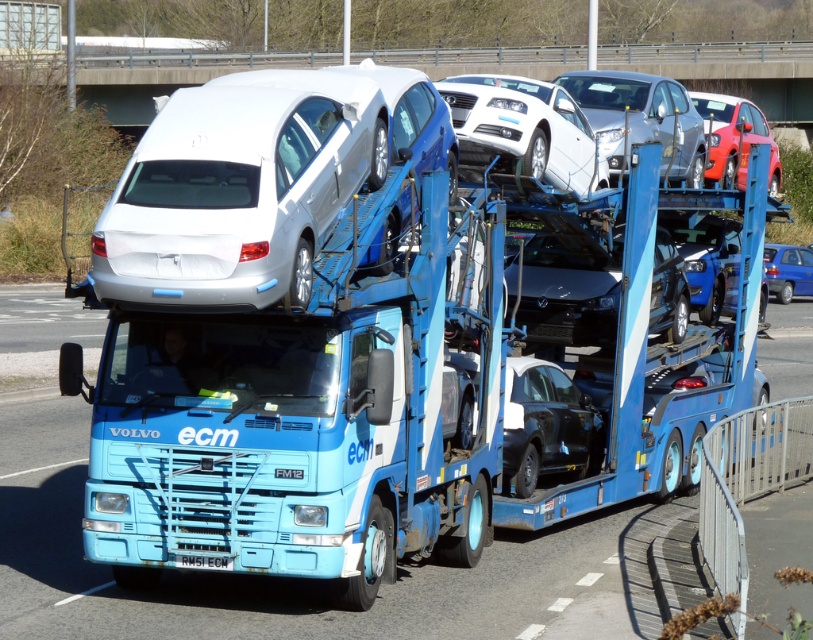
Does blue metallic truck at center have a greater width compared to white plastic license plate at center?

Yes, blue metallic truck at center is wider than white plastic license plate at center.

Is blue metallic truck at center to the right of white plastic license plate at center from the viewer's perspective?

Indeed, blue metallic truck at center is positioned on the right side of white plastic license plate at center.

Find the location of `blue metallic truck at center`. blue metallic truck at center is located at coordinates coord(380,401).

This screenshot has width=813, height=640. Find the location of `blue metallic truck at center`. blue metallic truck at center is located at coordinates (380, 401).

Between point (593, 179) and point (189, 566), which one is positioned in front?

Positioned in front is point (189, 566).

Who is shorter, white glossy sedan at upper center or white plastic license plate at center?

Standing shorter between the two is white plastic license plate at center.

Does point (518, 154) lie in front of point (198, 563)?

No.

At what (x,y) coordinates should I click in order to perform the action: click on white glossy sedan at upper center. Please return your answer as a coordinate pair (x, y). The height and width of the screenshot is (640, 813). Looking at the image, I should click on (524, 129).

Which is in front, point (801, 280) or point (229, 564)?

Positioned in front is point (229, 564).

Which of these two, blue metallic hatchback at right or white plastic license plate at center, stands taller?

blue metallic hatchback at right is taller.

Is point (809, 292) behind point (225, 557)?

Yes, it is.

Image resolution: width=813 pixels, height=640 pixels. What are the coordinates of `blue metallic hatchback at right` in the screenshot? It's located at (788, 269).